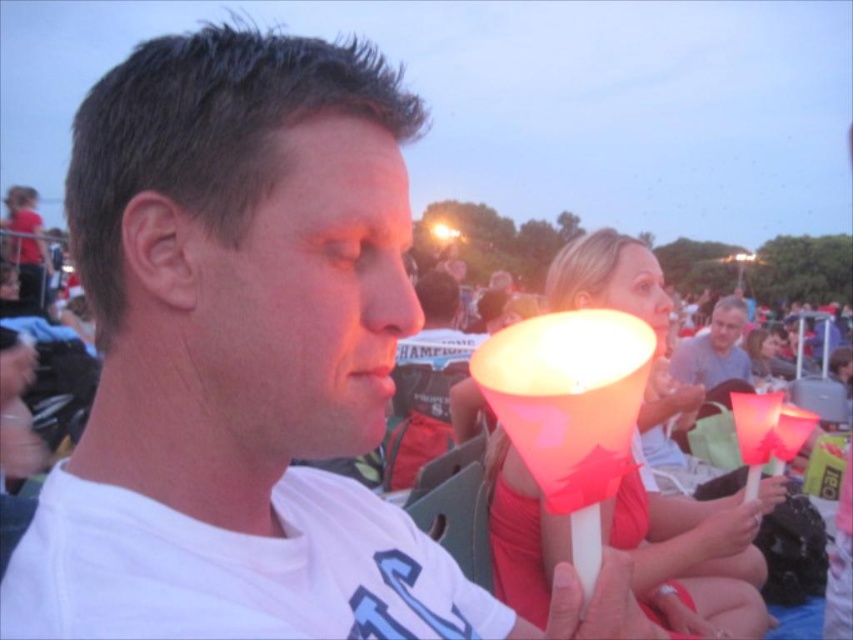
Does translucent plastic lamp at center have a larger size compared to matte plastic cone at center?

Incorrect, translucent plastic lamp at center is not larger than matte plastic cone at center.

Locate an element on the screen. This screenshot has width=853, height=640. translucent plastic lamp at center is located at coordinates (569, 410).

You are a GUI agent. You are given a task and a screenshot of the screen. Output one action in this format:
    pyautogui.click(x=<x>, y=<y>)
    Task: Click on the translucent plastic lamp at center
    The width and height of the screenshot is (853, 640).
    Given the screenshot: What is the action you would take?
    pyautogui.click(x=569, y=410)